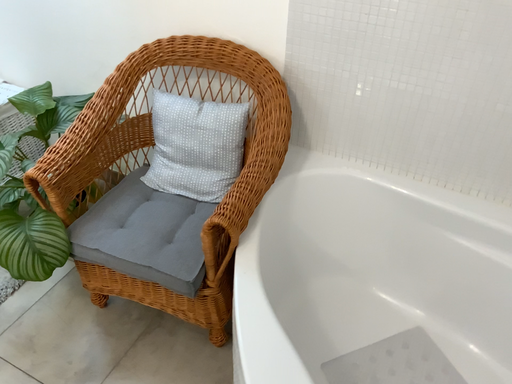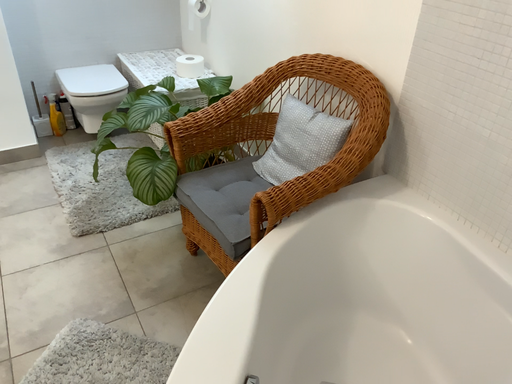
Question: Which way did the camera rotate in the video?

Choices:
 (A) rotated right
 (B) rotated left

Answer: (B)